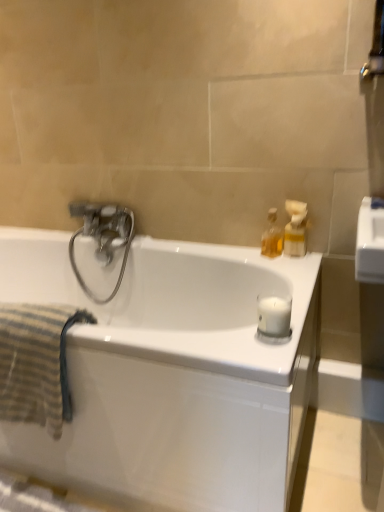
Question: Is metallic silver towel bar at upper right bigger or smaller than white matte candle at right?

Choices:
 (A) big
 (B) small

Answer: (A)

Question: Considering the positions of metallic silver towel bar at upper right and white matte candle at right in the image, is metallic silver towel bar at upper right taller or shorter than white matte candle at right?

Choices:
 (A) tall
 (B) short

Answer: (A)

Question: Based on their relative distances, which object is farther from the white matte candle at right?

Choices:
 (A) striped cotton towel at left
 (B) polished chrome faucet at upper left
 (C) translucent glass bottle at upper right, which is counted as the 2th soap dispenser, starting from the right
 (D) translucent plastic soap dispenser at upper right, the 2th soap dispenser positioned from the left
 (E) white glossy bathtub at center

Answer: (B)

Question: Estimate the real-world distances between objects in this image. Which object is farther from the striped cotton towel at left?

Choices:
 (A) translucent plastic soap dispenser at upper right, the 2th soap dispenser positioned from the left
 (B) white glossy bathtub at center
 (C) polished chrome faucet at upper left
 (D) metallic silver towel bar at upper right
 (E) translucent glass bottle at upper right, which is counted as the 1th soap dispenser, starting from the left

Answer: (D)